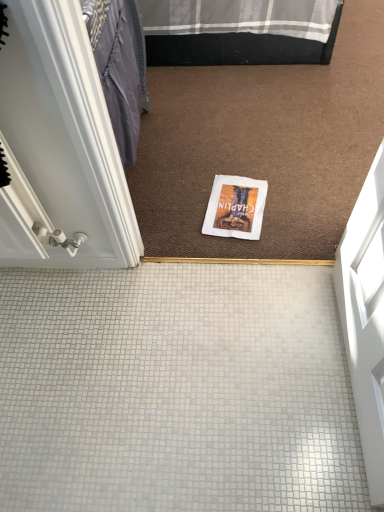
This screenshot has height=512, width=384. What are the coordinates of `free space above white paper magazine at center (from a real-world perspective)` in the screenshot? It's located at (236, 207).